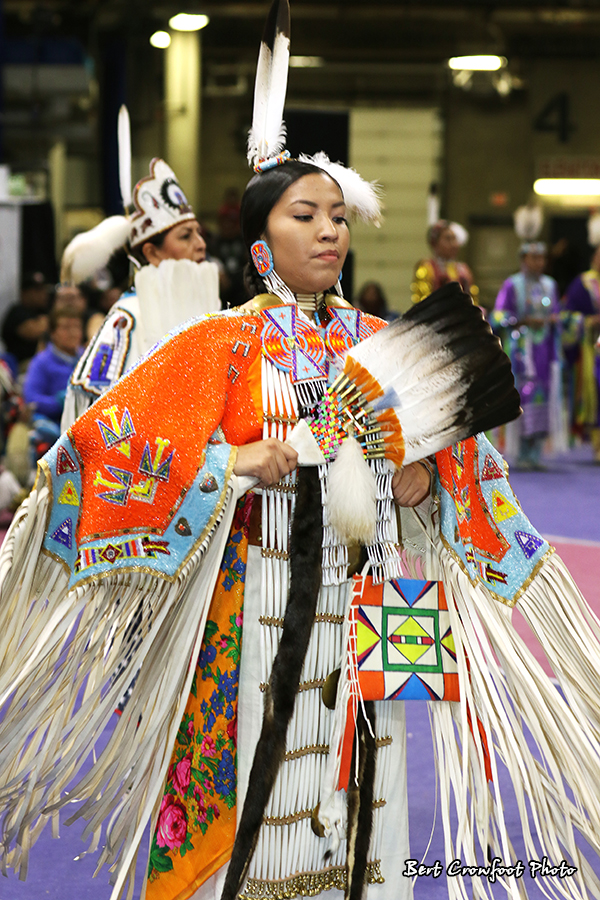
This screenshot has height=900, width=600. Find the location of `fan`. fan is located at coordinates (427, 378).